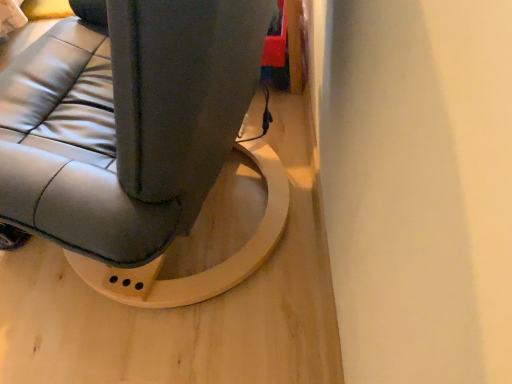
The width and height of the screenshot is (512, 384). Describe the element at coordinates (136, 140) in the screenshot. I see `matte gray chair at center` at that location.

Where is `matte gray chair at center`? matte gray chair at center is located at coordinates [136, 140].

I want to click on matte gray chair at center, so click(136, 140).